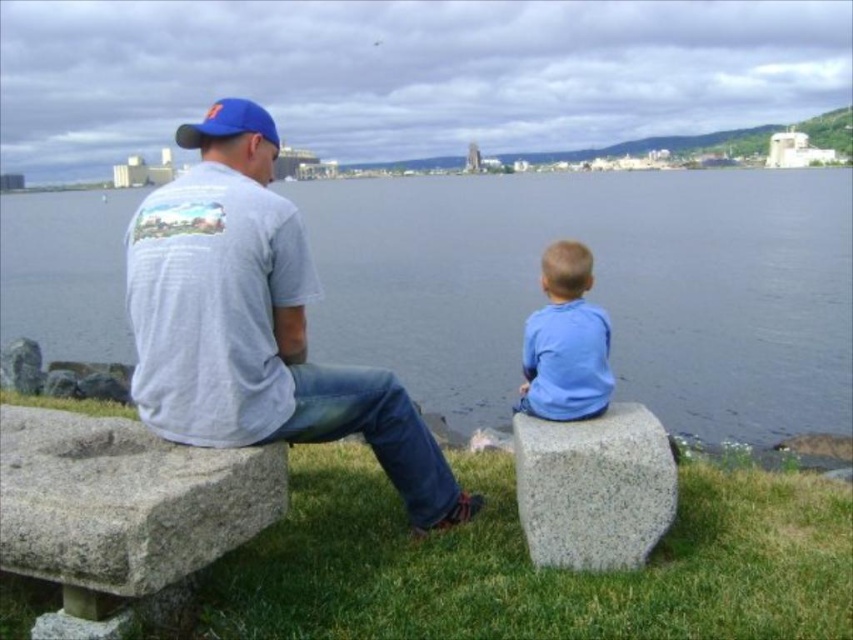
You are a painter standing at the edge of the water and want to place your 1.2 meter tall easel between the granite bench at lower left and the blue fabric baseball cap at upper center. Can the easel fit vertically between them?

The granite bench at lower left is shorter than the blue fabric baseball cap at upper center. Since the easel is 1.2 meters tall, it can fit vertically between them as the space between the two objects allows for that height.

You are a photographer trying to capture a photo of the granite bench at lower left and the blue fabric baseball cap at upper center. Based on their positions, which object should you adjust your camera to focus on first if you want to capture both in the same frame without moving the camera?

The granite bench at lower left should be focused on first because it is positioned to the right of the blue fabric baseball cap at upper center, so adjusting focus from left to right might help capture both in the same frame.